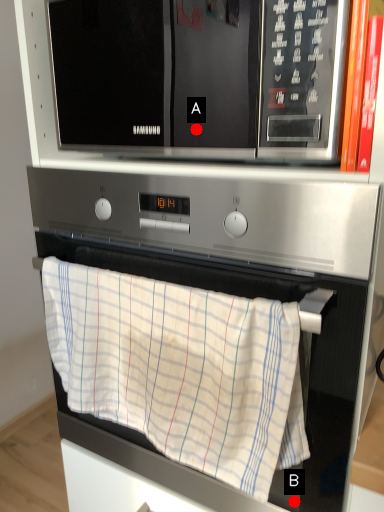
Question: Two points are circled on the image, labeled by A and B beside each circle. Which point is further to the camera?

Choices:
 (A) A is further
 (B) B is further

Answer: (B)